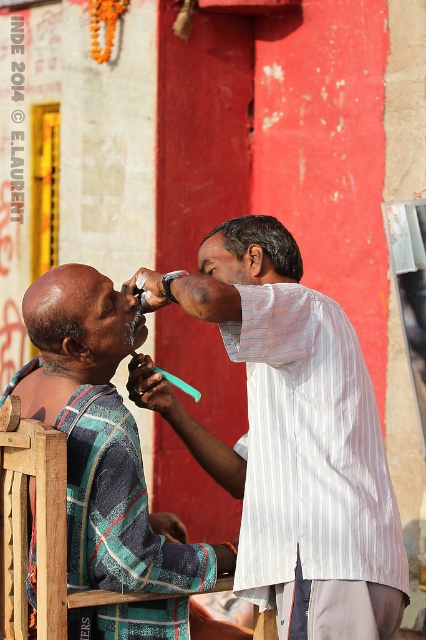
How far apart are white striped shirt at upper center and striped fabric shirt at left?

white striped shirt at upper center is 6.60 feet away from striped fabric shirt at left.

From the picture: Between white striped shirt at upper center and striped fabric shirt at left, which one has less height?

striped fabric shirt at left

The height and width of the screenshot is (640, 426). In order to click on white striped shirt at upper center in this screenshot , I will do `click(310, 449)`.